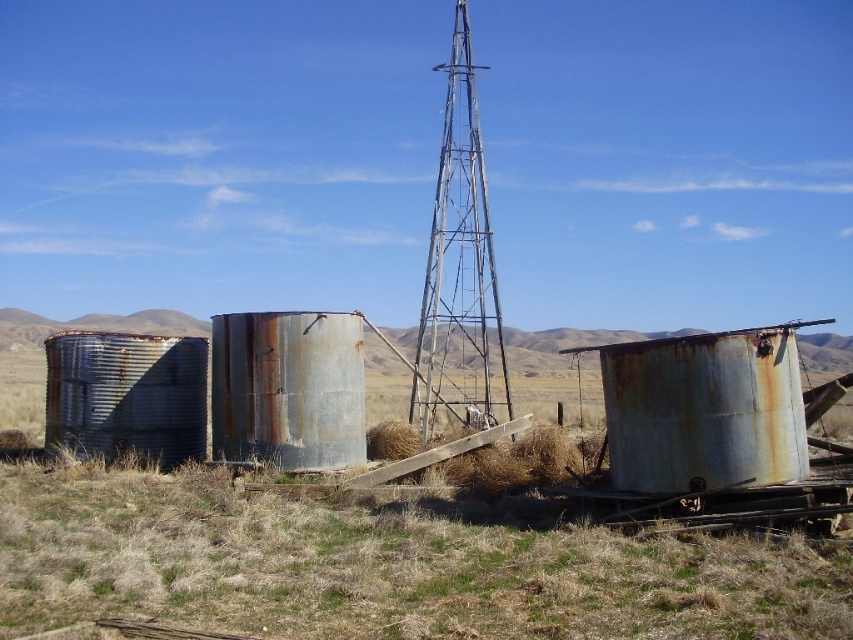
Question: Can you confirm if rusty metal water tower at center is positioned to the left of rusty metal silo at center?

Choices:
 (A) no
 (B) yes

Answer: (A)

Question: Which object is the farthest from the rusty metal water tower at center?

Choices:
 (A) rusty metal silo at center
 (B) dry grass at center

Answer: (B)

Question: Is rusty metal water tower at center thinner than rusty metal silo at center?

Choices:
 (A) no
 (B) yes

Answer: (A)

Question: In this image, where is rusty metal water tower at center located relative to rusty metal silo at center?

Choices:
 (A) below
 (B) above

Answer: (B)

Question: Which point is closer to the camera?

Choices:
 (A) (285, 428)
 (B) (425, 326)

Answer: (A)

Question: Which object is positioned closest to the dry grass at center?

Choices:
 (A) rusty metal water tower at center
 (B) rusty metal silo at center

Answer: (B)